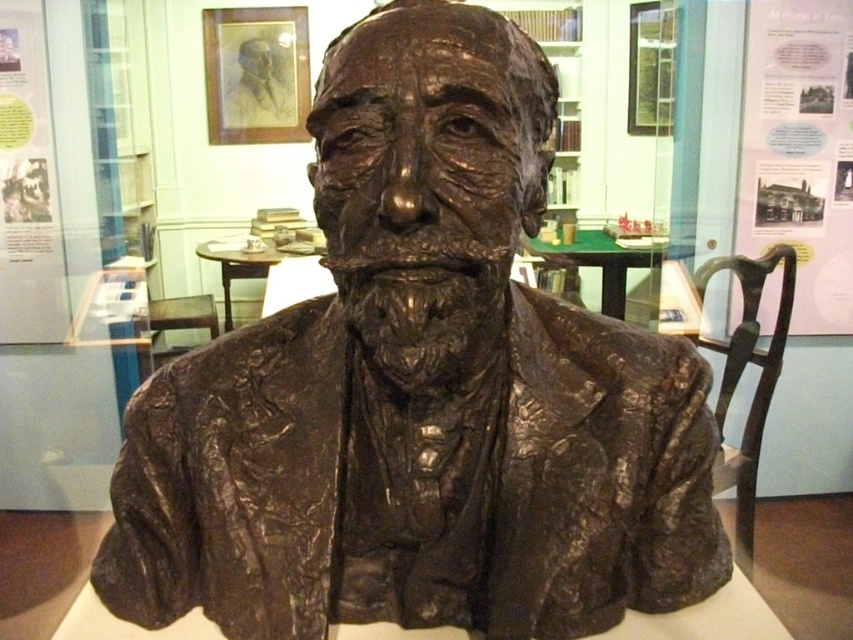
You are an art student who needs to sketch the bronze polished chair at right and the smooth gray pencil sketch at upper center. Since you want to capture their positions accurately, can you determine which object is closer to you?

The bronze polished chair at right is closer to you because it is in front of the smooth gray pencil sketch at upper center.

You are standing in front of the bronze bust sculpture and want to take a photo. There are two points marked in the image at coordinates point [741,502] and point [279,120]. Which point should you focus on to ensure the sculpture is in sharp focus?

You should focus on point [741,502] because it is closer to the camera than point [279,120], ensuring the sculpture is in sharp focus.